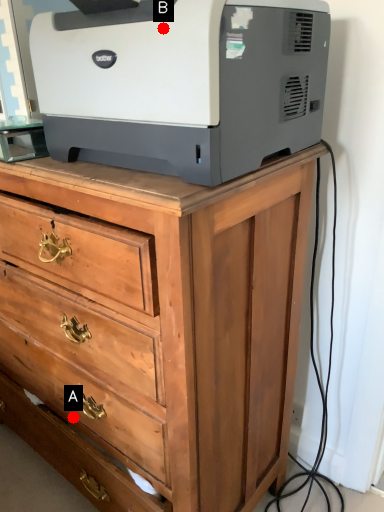
Question: Two points are circled on the image, labeled by A and B beside each circle. Which point appears closest to the camera in this image?

Choices:
 (A) A is closer
 (B) B is closer

Answer: (B)